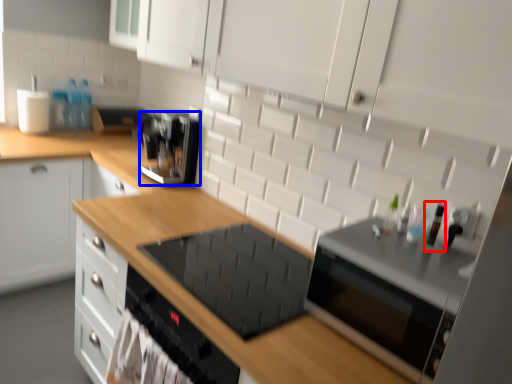
Question: Which point is closer to the camera, bottle (highlighted by a red box) or kitchen appliance (highlighted by a blue box)?

Choices:
 (A) bottle
 (B) kitchen appliance

Answer: (A)